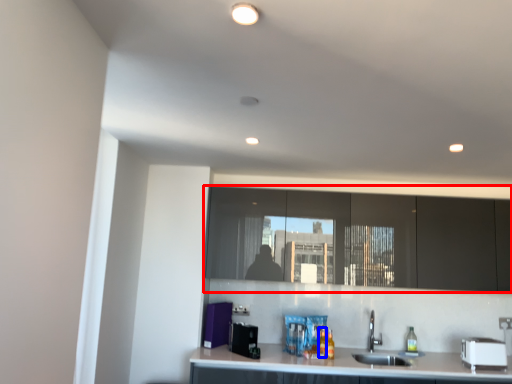
Question: Which of the following is the farthest to the observer, cabinetry (highlighted by a red box) or bottle (highlighted by a blue box)?

Choices:
 (A) cabinetry
 (B) bottle

Answer: (A)